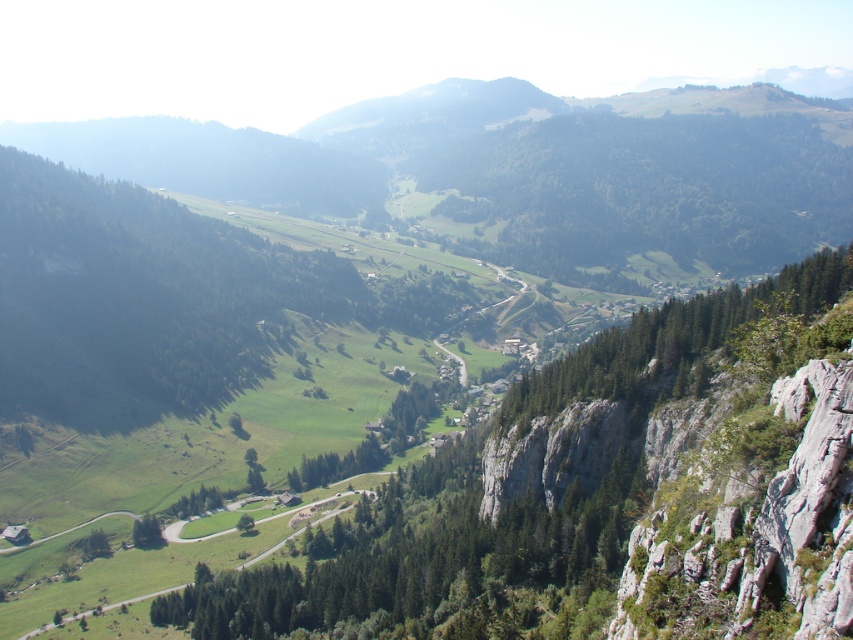
You are a hiker planning to take a photo of the mountain landscape. You want to include both the green leafy trees at center and the green leafy tree at lower left in your shot. Which tree will appear bigger in the photo?

The green leafy trees at center will appear bigger in the photo because they have a larger size compared to the green leafy tree at lower left.

You are standing at the point closer to the camera in this mountain landscape. Which point are you standing at, point (728,244) or point (140,518)?

You are standing at point (728,244) because it is further to the camera than point (140,518).